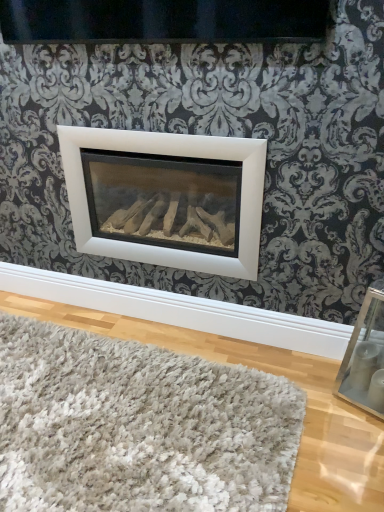
Where is `vacant space underneath clear glass picture frame at lower right (from a real-world perspective)`? The height and width of the screenshot is (512, 384). vacant space underneath clear glass picture frame at lower right (from a real-world perspective) is located at coordinates (360, 403).